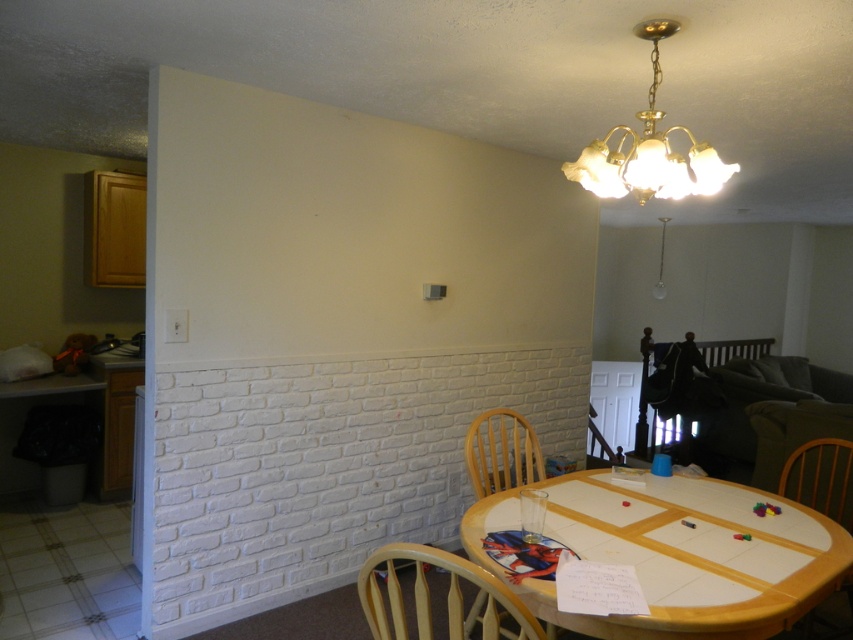
Question: Among these points, which one is farthest from the camera?

Choices:
 (A) (647, 484)
 (B) (357, 573)

Answer: (B)

Question: Based on their relative distances, which object is nearer to the light wood chair at lower center?

Choices:
 (A) wooden chair at center
 (B) gold glass chandelier at upper center

Answer: (A)

Question: Which object appears farthest from the camera in this image?

Choices:
 (A) light wood chair at lower center
 (B) wooden chair at lower right
 (C) gold glass chandelier at upper center
 (D) wooden table at lower center

Answer: (B)

Question: Can you confirm if light wood chair at lower center is positioned to the right of gold glass chandelier at upper center?

Choices:
 (A) yes
 (B) no

Answer: (B)

Question: Is gold glass chandelier at upper center closer to camera compared to wooden chair at lower right?

Choices:
 (A) no
 (B) yes

Answer: (B)

Question: Can you confirm if gold glass chandelier at upper center is positioned to the right of wooden chair at center?

Choices:
 (A) no
 (B) yes

Answer: (B)